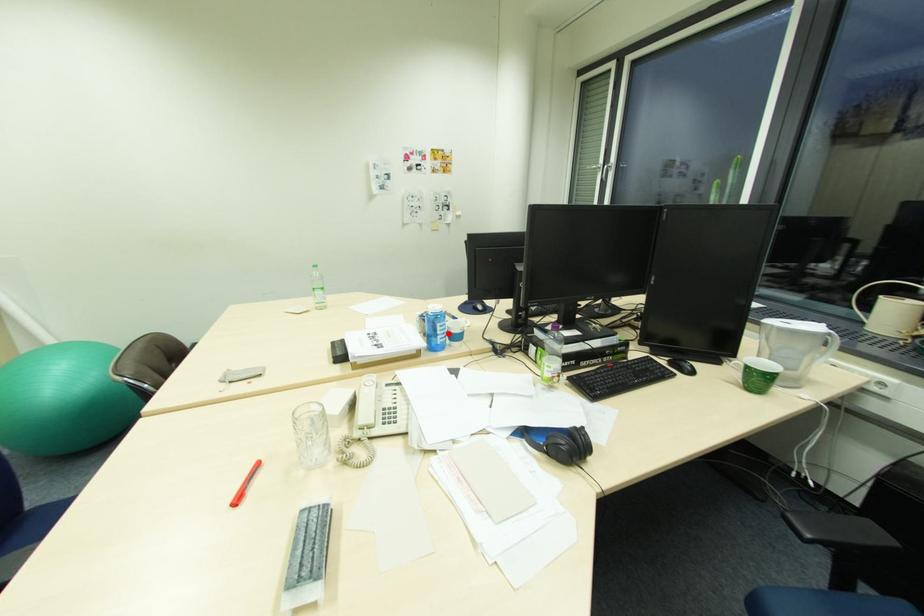
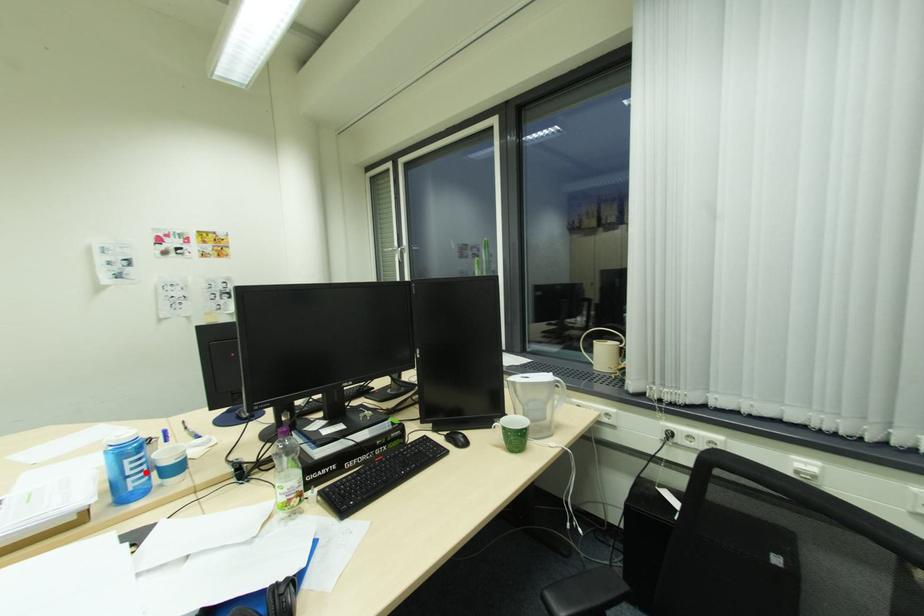
I am providing you with two images of the same scene from different viewpoints. A red point is marked on the first image and another point is marked on the second image. Are the points marked in image1 and image2 representing the same 3D position?

Yes